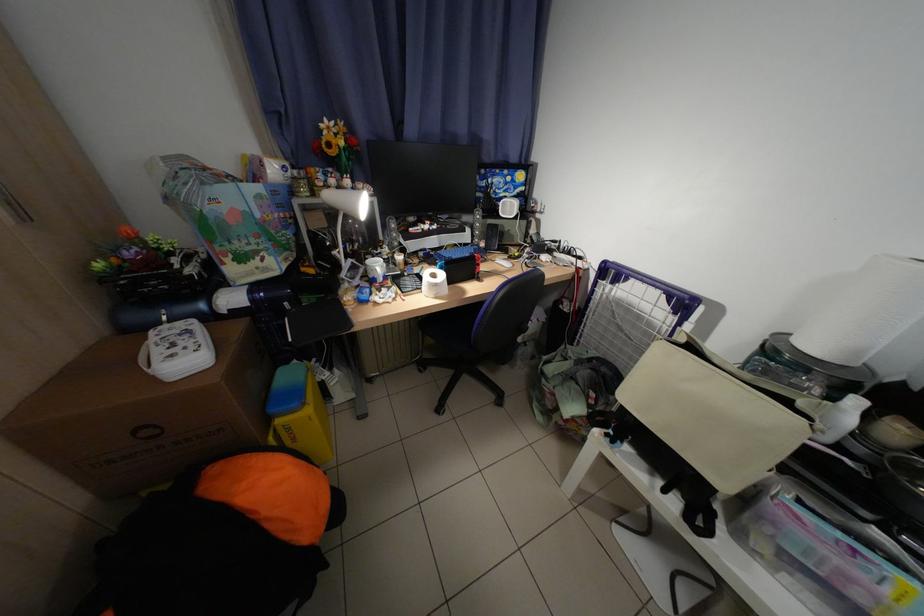
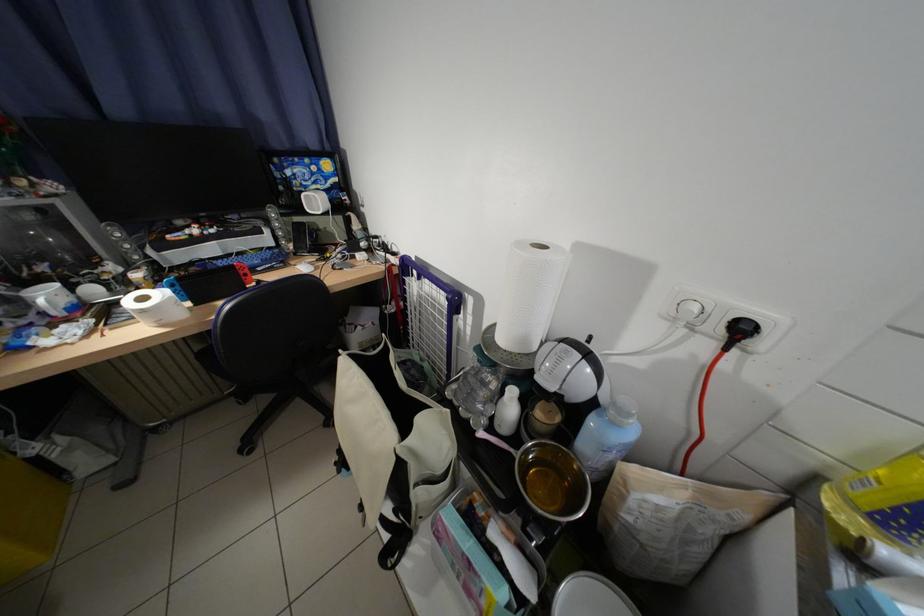
The point at (843, 400) is marked in the first image. Where is the corresponding point in the second image?

(514, 392)